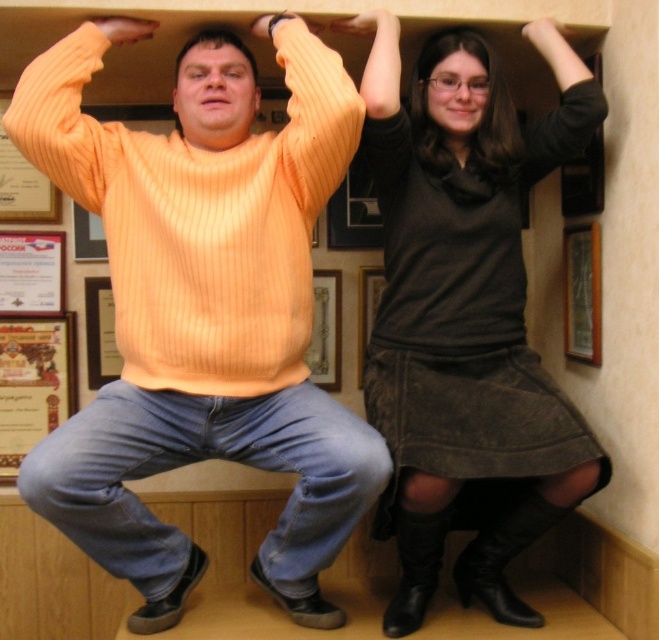
You are a photographer setting up a shoot in this enclosed space. You need to ensure that the dark brown suede skirt at upper right and the matte black hair at upper center are both visible in the frame. Given their current positions, can you fit both into the camera frame without moving either object?

The distance between the dark brown suede skirt at upper right and the matte black hair at upper center is 9.41 inches. Since the photographer can adjust the camera angle and zoom, it is possible to capture both objects within the frame without moving them, provided the camera has sufficient zoom capability to encompass the 9.41 inch separation between them.

You are standing in front of the enclosed cardboard box where two people are touching the top edges. There are two points marked on the box walls at coordinates point (430, 80) and point (428, 38). Which point is closer to you?

Point (430, 80) is closer to the viewer than point (428, 38).